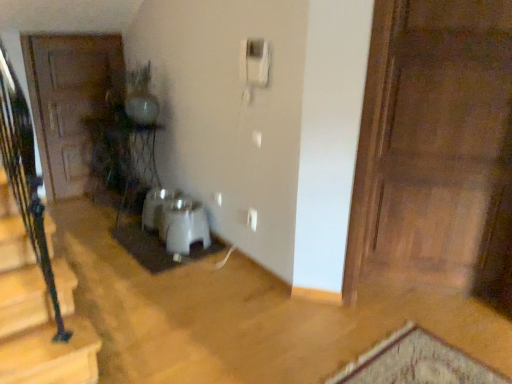
Find the location of a particular element. The image size is (512, 384). free space in front of white plastic water heater at center is located at coordinates (172, 259).